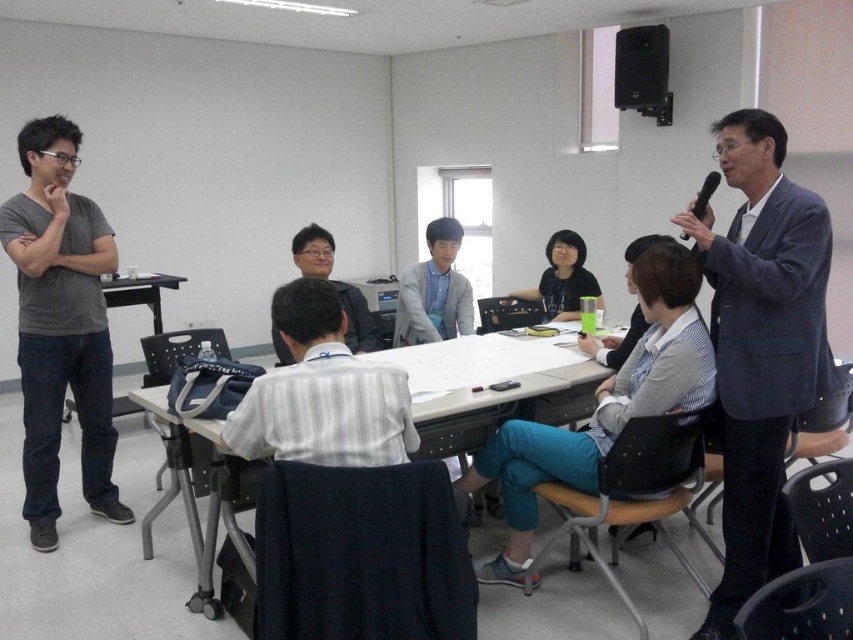
Does white striped shirt at center appear under black matte speaker at upper right?

Indeed, white striped shirt at center is positioned under black matte speaker at upper right.

Describe the element at coordinates (322, 392) in the screenshot. I see `white striped shirt at center` at that location.

Does point (329, 289) come closer to viewer compared to point (639, 28)?

Yes, it is in front of point (639, 28).

Find the location of a particular element. Image resolution: width=853 pixels, height=640 pixels. white striped shirt at center is located at coordinates (322, 392).

Does matte gray shirt at center appear under black plastic microphone at upper right?

Indeed, matte gray shirt at center is positioned under black plastic microphone at upper right.

Is matte gray shirt at center positioned before black plastic microphone at upper right?

No.

In order to click on matte gray shirt at center in this screenshot , I will do `click(357, 320)`.

The height and width of the screenshot is (640, 853). Describe the element at coordinates (759, 348) in the screenshot. I see `dark blue suit at upper right` at that location.

Can you confirm if dark blue suit at upper right is positioned to the left of white striped shirt at center?

In fact, dark blue suit at upper right is to the right of white striped shirt at center.

Find the location of a particular element. dark blue suit at upper right is located at coordinates (759, 348).